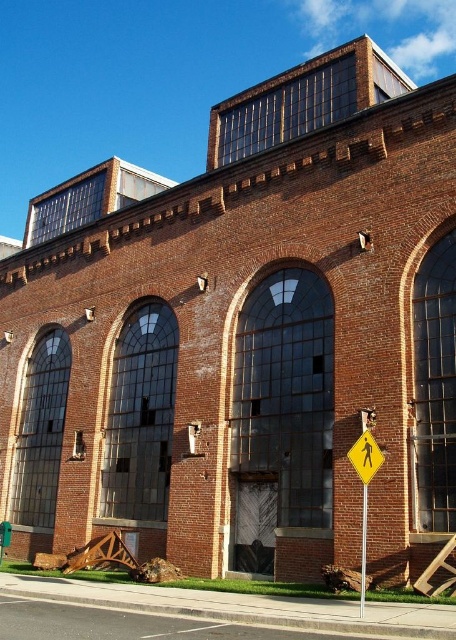
You are standing at the entrance of the historic brick building and want to cross the street safely. Where should you look for the yellow reflective plastic pedestrian crossing sign at lower right?

The yellow reflective plastic pedestrian crossing sign at lower right is located at point (366, 456), which is at the lower right area of the image.